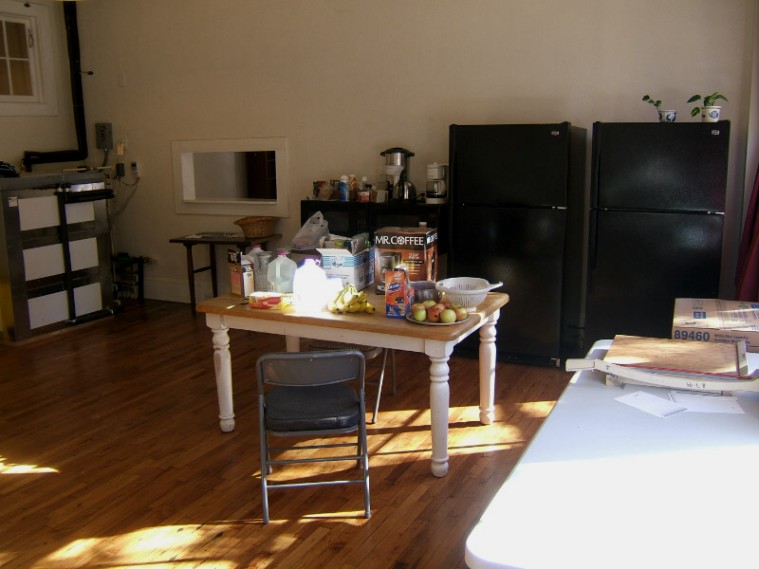
This screenshot has width=759, height=569. I want to click on window, so [x=19, y=53].